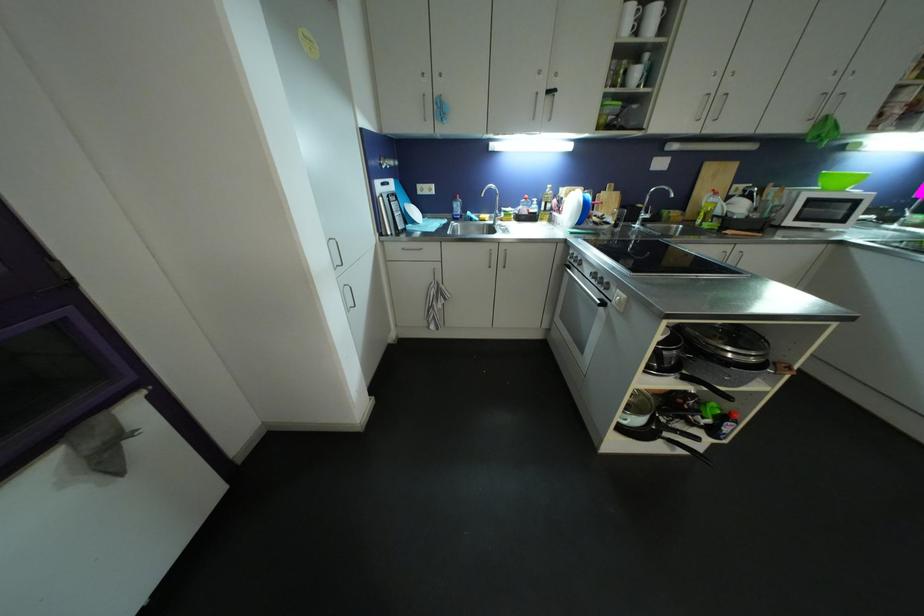
You are a GUI agent. You are given a task and a screenshot of the screen. Output one action in this format:
    pyautogui.click(x=<x>, y=<y>)
    Task: Click on the green bowl
    Image resolution: width=924 pixels, height=616 pixels.
    Given the screenshot: What is the action you would take?
    pyautogui.click(x=840, y=180)